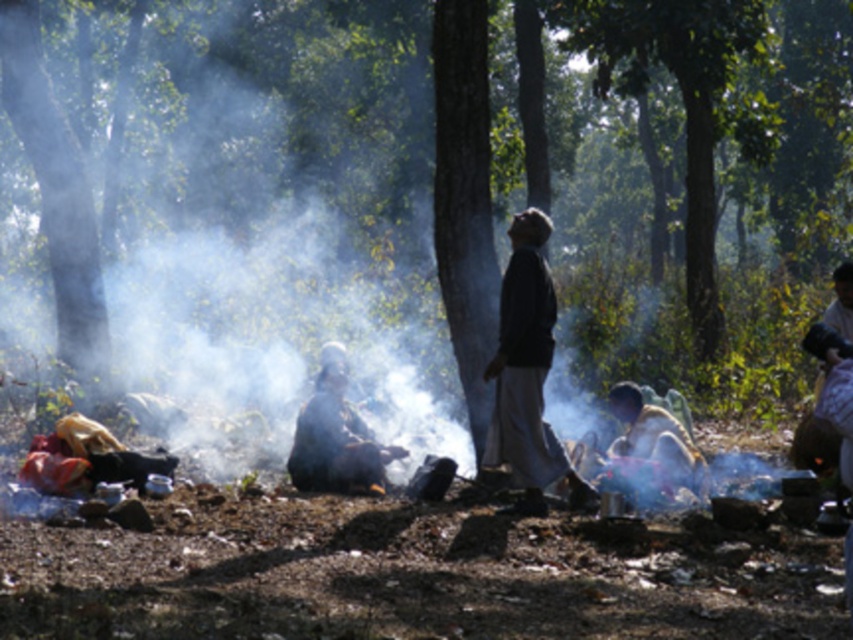
Between dark gray fabric at center and floral fabric dress at right, which one is positioned higher?

floral fabric dress at right is above.

Does point (358, 474) come behind point (827, 412)?

Yes, it is behind point (827, 412).

You are a GUI agent. You are given a task and a screenshot of the screen. Output one action in this format:
    pyautogui.click(x=<x>, y=<y>)
    Task: Click on the dark gray fabric at center
    This screenshot has width=853, height=640.
    Given the screenshot: What is the action you would take?
    pyautogui.click(x=335, y=436)

Can you confirm if dark brown fabric at center is taller than floral fabric dress at right?

Indeed, dark brown fabric at center has a greater height compared to floral fabric dress at right.

Between dark brown fabric at center and floral fabric dress at right, which one appears on the right side from the viewer's perspective?

Positioned to the right is floral fabric dress at right.

The image size is (853, 640). I want to click on dark brown fabric at center, so click(x=526, y=371).

This screenshot has width=853, height=640. Identify the location of dark brown fabric at center. (526, 371).

Consider the image. Is dark brown fabric at center positioned in front of dark gray fabric at center?

Yes, it is.

Is dark brown fabric at center bigger than dark gray fabric at center?

Yes, dark brown fabric at center is bigger than dark gray fabric at center.

Does point (534, 356) lie in front of point (370, 454)?

Yes.

Identify the location of dark brown fabric at center. The image size is (853, 640). (526, 371).